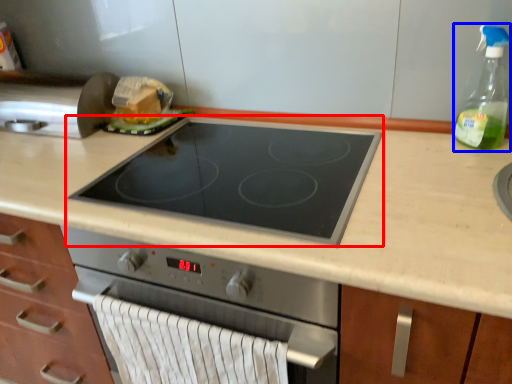
Question: Which object appears closest to the camera in this image, gas stove (highlighted by a red box) or bottle (highlighted by a blue box)?

Choices:
 (A) gas stove
 (B) bottle

Answer: (A)